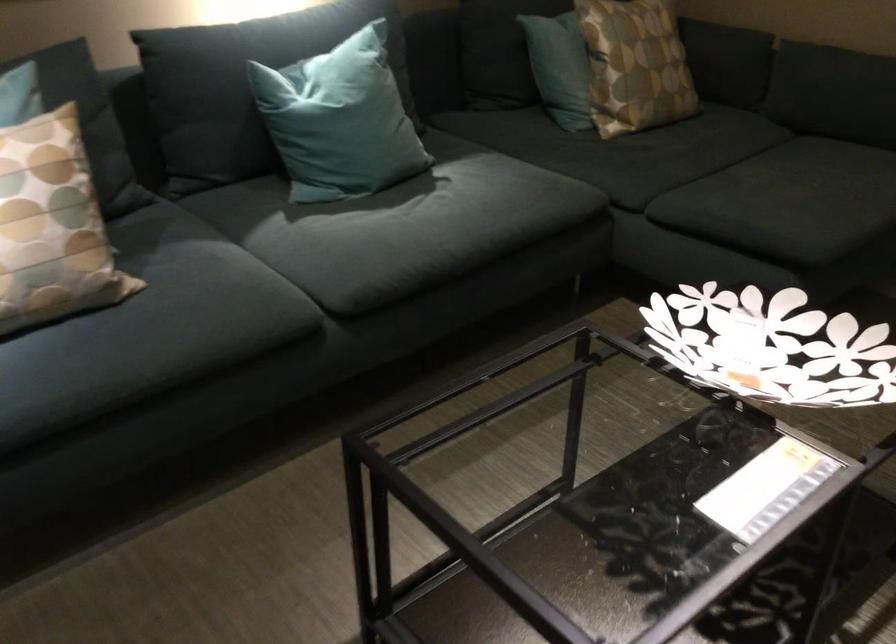
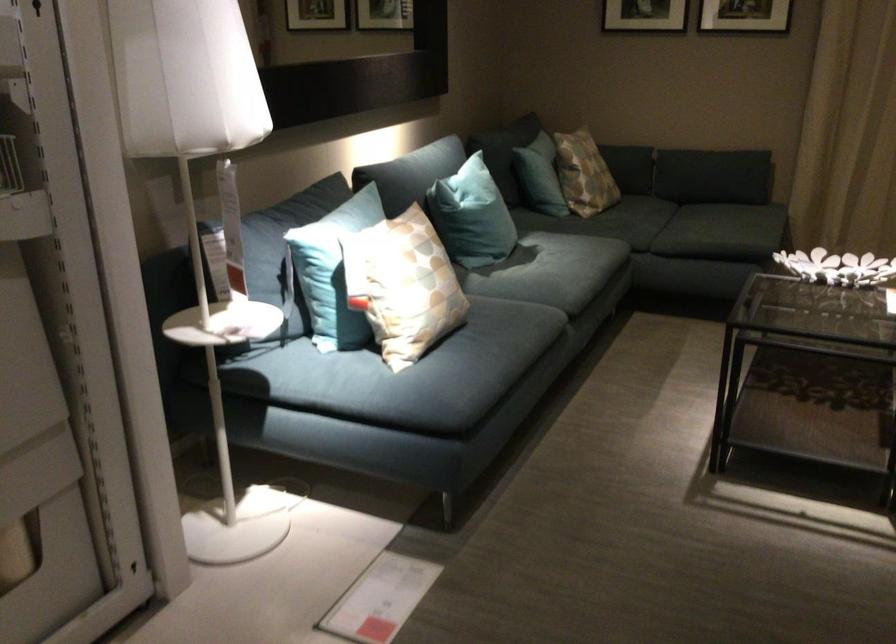
Locate, in the second image, the point that corresponds to the point at 751,365 in the first image.

(837, 267)